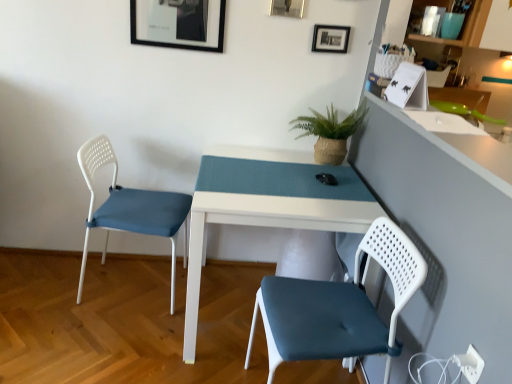
This screenshot has width=512, height=384. Find the location of `free space to the left of white plastic chair at left, positioned as the 2th chair in front-to-back order`. free space to the left of white plastic chair at left, positioned as the 2th chair in front-to-back order is located at coordinates (41, 288).